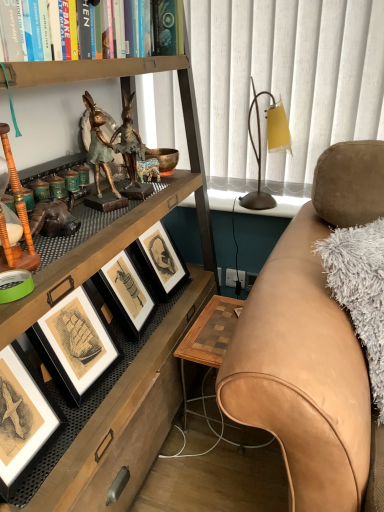
Find the location of a particular element. matte black picture frame at lower left is located at coordinates (23, 418).

What do you see at coordinates (23, 418) in the screenshot?
I see `matte black picture frame at lower left` at bounding box center [23, 418].

Measure the distance between point [276,146] and camera.

1.56 meters.

Identify the location of hardcover book at upper left. (10, 30).

What is the approximate height of bronze statue at upper left?

30.64 centimeters.

What do you see at coordinates (310, 344) in the screenshot?
I see `tan leather couch at right` at bounding box center [310, 344].

Where is `matte black picture frame at lower left`? Image resolution: width=384 pixels, height=512 pixels. matte black picture frame at lower left is located at coordinates (23, 418).

In order to click on table lying below the tan leather couch at right (from the image's perspective) in this screenshot , I will do `click(208, 337)`.

Is tan leather couch at right facing away from wooden checkered table at lower right?

No, wooden checkered table at lower right is not at the back of tan leather couch at right.

Based on their sizes in the image, would you say tan leather couch at right is bigger or smaller than wooden checkered table at lower right?

Clearly, tan leather couch at right is larger in size than wooden checkered table at lower right.

Is tan leather couch at right taller than wooden checkered table at lower right?

Yes, tan leather couch at right is taller than wooden checkered table at lower right.

In terms of height, does translucent glass lampshade at upper right look taller or shorter compared to wooden checkered table at lower right?

Considering their sizes, translucent glass lampshade at upper right has more height than wooden checkered table at lower right.

How many degrees apart are the facing directions of translucent glass lampshade at upper right and wooden checkered table at lower right?

0.0424 degrees.

Is wooden checkered table at lower right a part of translucent glass lampshade at upper right?

No.

From a real-world perspective, is tan leather couch at right over bronze statue at upper left?

Incorrect, from a real-world perspective, tan leather couch at right is lower than bronze statue at upper left.

Is tan leather couch at right positioned far away from bronze statue at upper left?

No.

Based on their sizes in the image, would you say tan leather couch at right is bigger or smaller than bronze statue at upper left?

In the image, tan leather couch at right appears to be larger than bronze statue at upper left.

From the picture: How many degrees apart are the facing directions of hardcover book at upper left and tan leather couch at right?

The angular difference between hardcover book at upper left and tan leather couch at right is 43.3 degrees.

Which object is more forward, hardcover book at upper left or tan leather couch at right?

tan leather couch at right is more forward.

Is hardcover book at upper left with tan leather couch at right?

hardcover book at upper left and tan leather couch at right are clearly separated.

Is tan leather couch at right a part of hardcover book at upper left?

No.

Does matte black picture frame at lower left come behind wooden checkered table at lower right?

No, it is in front of wooden checkered table at lower right.

From the image's perspective, is matte black picture frame at lower left above or below wooden checkered table at lower right?

From the image's perspective, matte black picture frame at lower left appears above wooden checkered table at lower right.

From a real-world perspective, is matte black picture frame at lower left located higher than wooden checkered table at lower right?

Indeed, from a real-world perspective, matte black picture frame at lower left stands above wooden checkered table at lower right.

This screenshot has height=512, width=384. Find the location of `table lamp behind the tan leather couch at right`. table lamp behind the tan leather couch at right is located at coordinates (268, 147).

Considering the points (260, 155) and (318, 453), which point is in front, point (260, 155) or point (318, 453)?

Point (318, 453)

Is translucent glass lampshade at upper right taller or shorter than tan leather couch at right?

In the image, translucent glass lampshade at upper right appears to be shorter than tan leather couch at right.

From the picture: Is translucent glass lampshade at upper right to the right of tan leather couch at right from the viewer's perspective?

Incorrect, translucent glass lampshade at upper right is not on the right side of tan leather couch at right.

From the image's perspective, does tan leather couch at right appear higher than hardcover book at upper left?

Incorrect, from the image's perspective, tan leather couch at right is lower than hardcover book at upper left.

From a real-world perspective, relative to hardcover book at upper left, is tan leather couch at right vertically above or below?

tan leather couch at right is below hardcover book at upper left.

Which of these two, tan leather couch at right or hardcover book at upper left, stands shorter?

With less height is hardcover book at upper left.

Does point (359, 502) appear closer or farther from the camera than point (88, 57)?

Point (359, 502).

This screenshot has width=384, height=512. I want to click on table to the left of tan leather couch at right, so click(x=208, y=337).

I want to click on table lamp behind the wooden checkered table at lower right, so click(268, 147).

Based on the photo, from the image, which object appears to be farther from wooden checkered table at lower right, translucent glass lampshade at upper right or tan leather couch at right?

translucent glass lampshade at upper right is positioned further to the anchor wooden checkered table at lower right.

In the scene shown: Which object lies further to the anchor point wooden checkered table at lower right, bronze statue at upper left or hardcover book at upper left?

Based on the image, hardcover book at upper left appears to be further to wooden checkered table at lower right.

Looking at the image, which one is located closer to matte black picture frame at lower left, wooden checkered table at lower right or translucent glass lampshade at upper right?

Based on the image, wooden checkered table at lower right appears to be nearer to matte black picture frame at lower left.

Considering their positions, is tan leather couch at right positioned further to bronze statue at upper left than translucent glass lampshade at upper right?

translucent glass lampshade at upper right is positioned further to the anchor bronze statue at upper left.

Looking at the image, which one is located further to wooden checkered table at lower right, hardcover book at upper left or translucent glass lampshade at upper right?

Based on the image, hardcover book at upper left appears to be further to wooden checkered table at lower right.

Considering their positions, is wooden checkered table at lower right positioned further to hardcover book at upper left than translucent glass lampshade at upper right?

The object further to hardcover book at upper left is wooden checkered table at lower right.

Which object lies further to the anchor point hardcover book at upper left, matte black picture frame at lower left or translucent glass lampshade at upper right?

Based on the image, translucent glass lampshade at upper right appears to be further to hardcover book at upper left.

Estimate the real-world distances between objects in this image. Which object is further from bronze statue at upper left, matte black picture frame at lower left or hardcover book at upper left?

matte black picture frame at lower left.

This screenshot has height=512, width=384. I want to click on table lamp between matte black picture frame at lower left and tan leather couch at right in the horizontal direction, so click(x=268, y=147).

This screenshot has height=512, width=384. I want to click on picture frame between translucent glass lampshade at upper right and wooden checkered table at lower right vertically, so click(x=23, y=418).

Image resolution: width=384 pixels, height=512 pixels. I want to click on book between tan leather couch at right and translucent glass lampshade at upper right in the front-back direction, so click(x=10, y=30).

This screenshot has height=512, width=384. Identify the location of studio couch that lies between hardcover book at upper left and wooden checkered table at lower right from top to bottom. (310, 344).